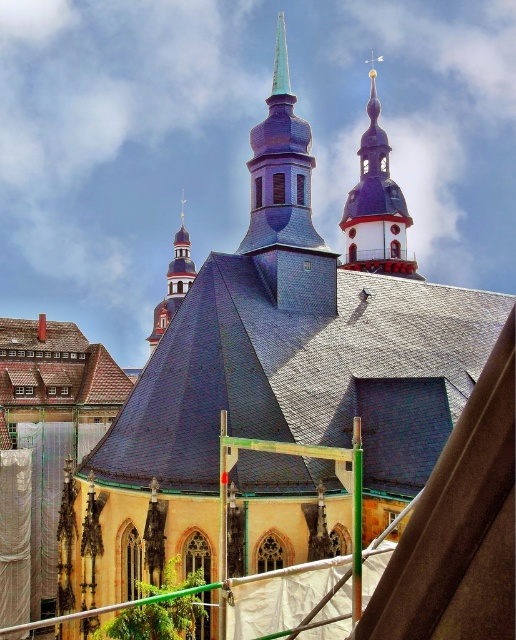
You are an architect designing a new church and want to ensure the purple matte steeple at upper center and the smooth red wood spire at upper left are proportionally balanced. Given their widths, which steeple should be placed closer to the central axis of the building to maintain visual harmony?

The purple matte steeple at upper center has a larger width than the smooth red wood spire at upper left. To maintain visual harmony, the wider purple matte steeple at upper center should be placed closer to the central axis of the building, while the narrower smooth red wood spire at upper left can be positioned further away, balancing their visual weight.

You are an architect analyzing the church design. Which spire would require more materials to construct, the purple matte steeple at upper center or the smooth red wood spire at upper left?

The purple matte steeple at upper center requires more materials to construct because it is larger in size than the smooth red wood spire at upper left.